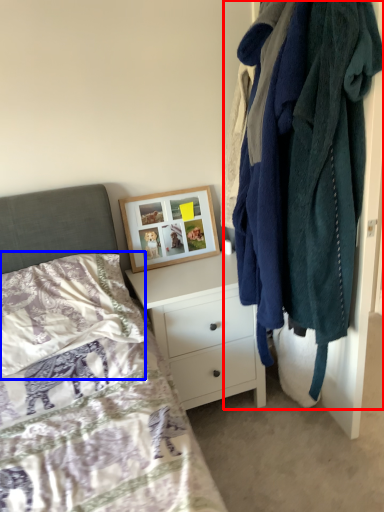
Question: Which of the following is the closest to the observer, closet (highlighted by a red box) or pillow (highlighted by a blue box)?

Choices:
 (A) closet
 (B) pillow

Answer: (A)